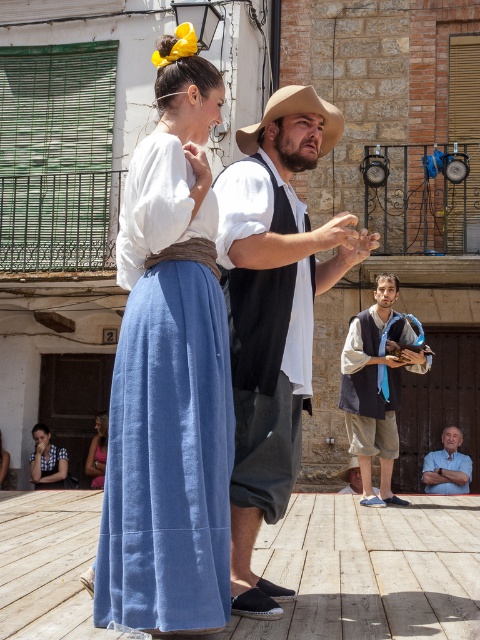
Does matte white shirt at center have a greater width compared to light brown felt cowboy hat at center?

Yes.

Which is in front, point (361, 234) or point (295, 86)?

Point (361, 234)

At what (x,y) coordinates should I click in order to perform the action: click on matte white shirt at center. Please return your answer as a coordinate pair (x, y). Image resolution: width=480 pixels, height=640 pixels. Looking at the image, I should click on (274, 314).

Can you confirm if dark brown leather vest at center is smaller than light brown felt cowboy hat at center?

No.

Is dark brown leather vest at center to the left of light brown felt cowboy hat at center from the viewer's perspective?

No, dark brown leather vest at center is not to the left of light brown felt cowboy hat at center.

Find the location of a particular element. dark brown leather vest at center is located at coordinates coord(374,387).

Can you confirm if dark brown leather vest at center is positioned to the left of silky pink dress at lower left?

In fact, dark brown leather vest at center is to the right of silky pink dress at lower left.

From the picture: Can you confirm if dark brown leather vest at center is bigger than silky pink dress at lower left?

Indeed, dark brown leather vest at center has a larger size compared to silky pink dress at lower left.

Is point (422, 360) closer to viewer compared to point (96, 419)?

Yes, it is.

Locate an element on the screen. dark brown leather vest at center is located at coordinates (374, 387).